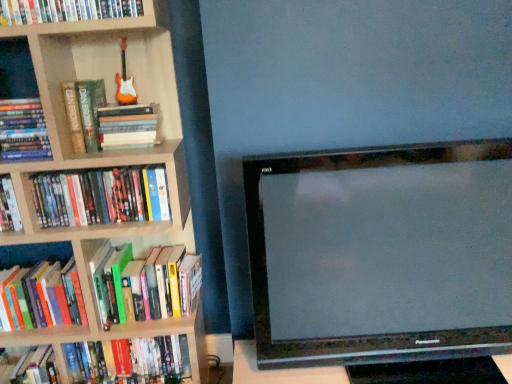
Question: From a real-world perspective, is hardcover book at left, which ranks as the 5th book in bottom-to-top order, above or below hardcover book at left, placed as the fourth book when sorted from top to bottom?

Choices:
 (A) below
 (B) above

Answer: (B)

Question: From the image's perspective, is hardcover book at left, which ranks as the 5th book in bottom-to-top order, located above or below hardcover book at left, placed as the fourth book when sorted from top to bottom?

Choices:
 (A) above
 (B) below

Answer: (A)

Question: Which of these objects is positioned closest to the satin black television at center?

Choices:
 (A) wooden bookshelf at left
 (B) hardcover book at left, which is counted as the third book, starting from the bottom
 (C) hardcover book at upper left, positioned as the first book in top-to-bottom order
 (D) hardcover book at left, the 6th book viewed from the top
 (E) hardcover book at left, placed as the fourth book when sorted from top to bottom

Answer: (D)

Question: Which object is positioned closest to the hardcover book at left, placed as the fourth book when sorted from top to bottom?

Choices:
 (A) hardcover book at left, the fifth book in the top-to-bottom sequence
 (B) satin black television at center
 (C) hardcover book at left, which is the second book from bottom to top
 (D) wooden bookshelf at left
 (E) hardcover book at left, the seventh book from the top

Answer: (D)